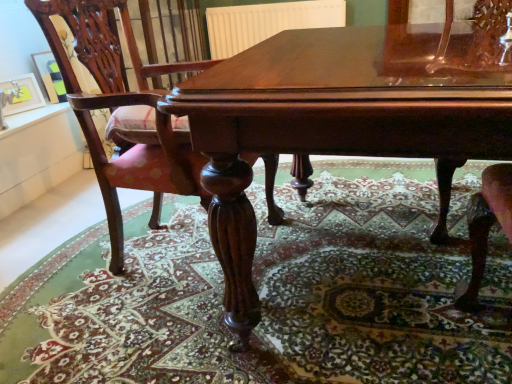
How much space does brushed metal picture frame at upper left, which is counted as the 1th picture frame, starting from the front, occupy vertically?

It is 7.50 inches.

What are the coordinates of `polished wood table at center` in the screenshot? It's located at (338, 121).

You are a GUI agent. You are given a task and a screenshot of the screen. Output one action in this format:
    pyautogui.click(x=<x>, y=<y>)
    Task: Click on the polished wood chair at center
    The height and width of the screenshot is (384, 512).
    Given the screenshot: What is the action you would take?
    pyautogui.click(x=120, y=106)

In the scene shown: Can you confirm if brushed metal picture frame at upper left, which is counted as the 1th picture frame, starting from the front, is wider than polished wood table at center?

In fact, brushed metal picture frame at upper left, which is counted as the 1th picture frame, starting from the front, might be narrower than polished wood table at center.

From a real-world perspective, which is physically above, brushed metal picture frame at upper left, arranged as the second picture frame when viewed from the back, or polished wood table at center?

In real-world perspective, brushed metal picture frame at upper left, arranged as the second picture frame when viewed from the back, is above.

Considering the positions of point (31, 94) and point (498, 131), is point (31, 94) closer or farther from the camera than point (498, 131)?

Point (31, 94) appears to be farther away from the viewer than point (498, 131).

Is brushed metal picture frame at upper left, which is counted as the 1th picture frame, starting from the front, not inside polished wood table at center?

That's correct, brushed metal picture frame at upper left, which is counted as the 1th picture frame, starting from the front, is outside of polished wood table at center.

Considering the relative sizes of matte black picture frame at upper left, which appears as the first picture frame when viewed from the back, and polished wood chair at center in the image provided, is matte black picture frame at upper left, which appears as the first picture frame when viewed from the back, bigger than polished wood chair at center?

No.

Consider the image. Which of these two, matte black picture frame at upper left, which appears as the first picture frame when viewed from the back, or polished wood chair at center, is thinner?

matte black picture frame at upper left, which appears as the first picture frame when viewed from the back.

Considering the positions of objects matte black picture frame at upper left, which appears as the first picture frame when viewed from the back, and polished wood chair at center in the image provided, who is more to the left, matte black picture frame at upper left, which appears as the first picture frame when viewed from the back, or polished wood chair at center?

Positioned to the left is matte black picture frame at upper left, which appears as the first picture frame when viewed from the back.

Which object is closer to the camera, matte black picture frame at upper left, which is the 2th picture frame from front to back, or polished wood chair at center?

polished wood chair at center is more forward.

Considering the sizes of brushed metal picture frame at upper left, which is counted as the 1th picture frame, starting from the front, and carpeted floor at center in the image, is brushed metal picture frame at upper left, which is counted as the 1th picture frame, starting from the front, taller or shorter than carpeted floor at center?

Clearly, brushed metal picture frame at upper left, which is counted as the 1th picture frame, starting from the front, is taller compared to carpeted floor at center.

Which is in front, point (42, 104) or point (303, 261)?

The point (303, 261) is closer.

From the image's perspective, starting from the carpeted floor at center, which picture frame is the 1st one above? Please provide its 2D coordinates.

[(22, 94)]

Is brushed metal picture frame at upper left, which is counted as the 1th picture frame, starting from the front, facing towards carpeted floor at center?

Yes.

Consider the image. Considering the relative positions of polished wood table at center and matte black picture frame at upper left, which is the 2th picture frame from front to back, in the image provided, is polished wood table at center behind matte black picture frame at upper left, which is the 2th picture frame from front to back,?

No.

From the image's perspective, is polished wood table at center below matte black picture frame at upper left, which appears as the first picture frame when viewed from the back?

Yes.

Is polished wood table at center spatially inside matte black picture frame at upper left, which is the 2th picture frame from front to back, or outside of it?

polished wood table at center is spatially situated outside matte black picture frame at upper left, which is the 2th picture frame from front to back.

In terms of height, does polished wood table at center look taller or shorter compared to matte black picture frame at upper left, which is the 2th picture frame from front to back?

Considering their sizes, polished wood table at center has more height than matte black picture frame at upper left, which is the 2th picture frame from front to back.

In the scene shown: Is white matte radiator at upper center smaller than polished wood chair at center?

Yes.

What's the angular difference between white matte radiator at upper center and polished wood chair at center's facing directions?

90.3 degrees separate the facing orientations of white matte radiator at upper center and polished wood chair at center.

Looking at this image, does white matte radiator at upper center have a lesser width compared to polished wood chair at center?

Correct, the width of white matte radiator at upper center is less than that of polished wood chair at center.

Considering the points (158, 374) and (58, 100), which point is behind, point (158, 374) or point (58, 100)?

The point (58, 100) is more distant.

In the scene shown: How different are the orientations of carpeted floor at center and matte black picture frame at upper left, which is the 2th picture frame from front to back, in degrees?

67.7 degrees.

Between carpeted floor at center and matte black picture frame at upper left, which appears as the first picture frame when viewed from the back, which one is positioned behind?

matte black picture frame at upper left, which appears as the first picture frame when viewed from the back, is further from the camera.

From the image's perspective, is carpeted floor at center below matte black picture frame at upper left, which appears as the first picture frame when viewed from the back?

Yes, from the image's perspective, carpeted floor at center is beneath matte black picture frame at upper left, which appears as the first picture frame when viewed from the back.

Is point (246, 46) closer to viewer compared to point (24, 111)?

That is False.

Could you measure the distance between white matte radiator at upper center and brushed metal picture frame at upper left, arranged as the second picture frame when viewed from the back?

A distance of 1.82 meters exists between white matte radiator at upper center and brushed metal picture frame at upper left, arranged as the second picture frame when viewed from the back.

From the image's perspective, which object appears higher, white matte radiator at upper center or brushed metal picture frame at upper left, arranged as the second picture frame when viewed from the back?

From the image's view, white matte radiator at upper center is above.

Could you tell me if white matte radiator at upper center is facing brushed metal picture frame at upper left, which is counted as the 1th picture frame, starting from the front?

Yes, white matte radiator at upper center is turned towards brushed metal picture frame at upper left, which is counted as the 1th picture frame, starting from the front.

In the image, there is a brushed metal picture frame at upper left, which is counted as the 1th picture frame, starting from the front. Identify the location of table below it (from the image's perspective). pos(338,121).

From a real-world perspective, count 2nd picture frames upward from the polished wood chair at center and point to it. Please provide its 2D coordinates.

[(50, 76)]

Looking at the image, which one is located further to matte black picture frame at upper left, which appears as the first picture frame when viewed from the back, carpeted floor at center or brushed metal picture frame at upper left, which is counted as the 1th picture frame, starting from the front?

carpeted floor at center is further to matte black picture frame at upper left, which appears as the first picture frame when viewed from the back.

Based on their spatial positions, is matte black picture frame at upper left, which is the 2th picture frame from front to back, or carpeted floor at center closer to polished wood chair at center?

The object closer to polished wood chair at center is carpeted floor at center.

From the image, which object appears to be farther from white matte radiator at upper center, polished wood table at center or matte black picture frame at upper left, which appears as the first picture frame when viewed from the back?

polished wood table at center lies further to white matte radiator at upper center than the other object.

Based on their spatial positions, is brushed metal picture frame at upper left, arranged as the second picture frame when viewed from the back, or carpeted floor at center closer to matte black picture frame at upper left, which appears as the first picture frame when viewed from the back?

brushed metal picture frame at upper left, arranged as the second picture frame when viewed from the back, is closer to matte black picture frame at upper left, which appears as the first picture frame when viewed from the back.

Considering their positions, is polished wood chair at center positioned closer to brushed metal picture frame at upper left, arranged as the second picture frame when viewed from the back, than matte black picture frame at upper left, which is the 2th picture frame from front to back?

Among the two, matte black picture frame at upper left, which is the 2th picture frame from front to back, is located nearer to brushed metal picture frame at upper left, arranged as the second picture frame when viewed from the back.

Based on their spatial positions, is white matte radiator at upper center or brushed metal picture frame at upper left, which is counted as the 1th picture frame, starting from the front, closer to polished wood chair at center?

The object closer to polished wood chair at center is brushed metal picture frame at upper left, which is counted as the 1th picture frame, starting from the front.

Which object lies further to the anchor point carpeted floor at center, brushed metal picture frame at upper left, which is counted as the 1th picture frame, starting from the front, or white matte radiator at upper center?

The object further to carpeted floor at center is white matte radiator at upper center.

In the scene shown: When comparing their distances from white matte radiator at upper center, does polished wood table at center or brushed metal picture frame at upper left, which is counted as the 1th picture frame, starting from the front, seem further?

Among the two, polished wood table at center is located further to white matte radiator at upper center.

Locate an element on the screen. Image resolution: width=512 pixels, height=384 pixels. chair located between carpeted floor at center and matte black picture frame at upper left, which appears as the first picture frame when viewed from the back, in the depth direction is located at coordinates (120, 106).

The height and width of the screenshot is (384, 512). I want to click on chair between carpeted floor at center and white matte radiator at upper center along the z-axis, so click(120, 106).

The width and height of the screenshot is (512, 384). What are the coordinates of `mat between polished wood chair at center and polished wood table at center in the horizontal direction` in the screenshot? It's located at (269, 294).

Find the location of a particular element. This screenshot has width=512, height=384. chair between polished wood table at center and white matte radiator at upper center along the z-axis is located at coordinates (120, 106).